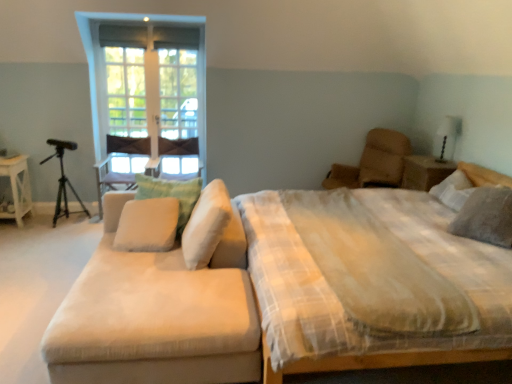
Question: Looking at the image, does beige fabric pillow at center, which appears as the second pillow when viewed from the right, seem bigger or smaller compared to white glossy table lamp at upper right?

Choices:
 (A) big
 (B) small

Answer: (A)

Question: Is point (219, 216) closer or farther from the camera than point (453, 122)?

Choices:
 (A) closer
 (B) farther

Answer: (A)

Question: Estimate the real-world distances between objects in this image. Which object is farther from the black matte tripod at left?

Choices:
 (A) beige fabric armchair at center
 (B) green fabric pillow at center, which is the 2th pillow from left to right
 (C) gray textured pillow at right, arranged as the 4th pillow when viewed from the left
 (D) white glossy table lamp at upper right
 (E) beige fabric pillow at center, arranged as the first pillow when viewed from the left

Answer: (D)

Question: Which object is the closest to the white glossy table lamp at upper right?

Choices:
 (A) plaid fabric bed at center
 (B) white wood side table at left, which ranks as the 2th nightstand in right-to-left order
 (C) leather swivel chair at upper right
 (D) gray textured pillow at right, arranged as the 4th pillow when viewed from the left
 (E) green fabric pillow at center, the third pillow viewed from the right

Answer: (C)